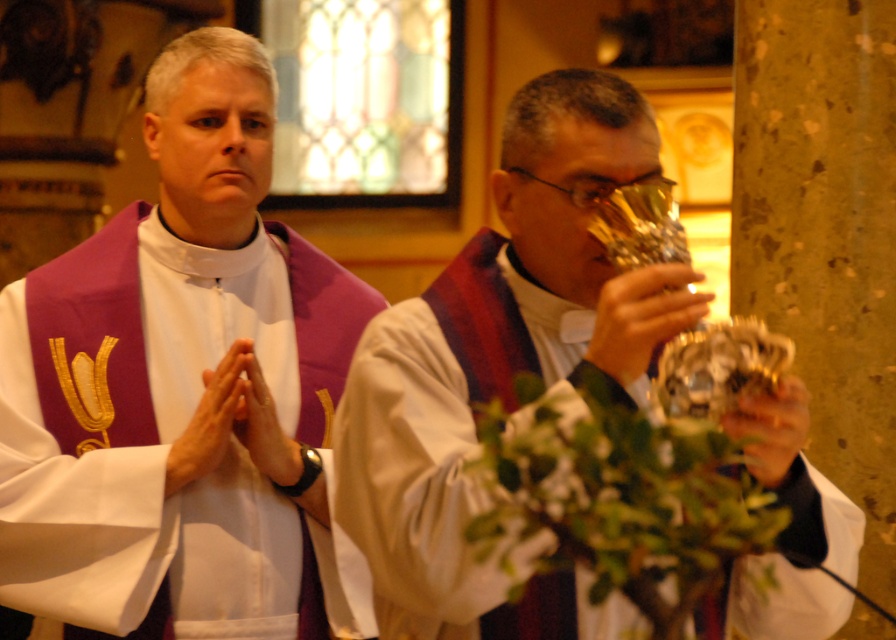
You are an event planner organizing a religious ceremony and need to place a decorative centerpiece between the purple velvet stole at center and the metallic gold chalice at center. Which object should the centerpiece be placed closer to if you want it to be visually balanced?

The purple velvet stole at center is larger in size compared to the metallic gold chalice at center. To achieve visual balance, the centerpiece should be placed closer to the metallic gold chalice at center to compensate for its smaller size.

You are an event photographer at the ceremony. You need to capture a closeup shot of both the purple velvet stole at center and the metallic gold chalice at center. Which object should you focus on first if you want to maintain the natural arrangement of the scene?

The purple velvet stole at center is positioned on the left side of metallic gold chalice at center, so you should focus on the purple velvet stole at center first to maintain the natural arrangement from left to right.